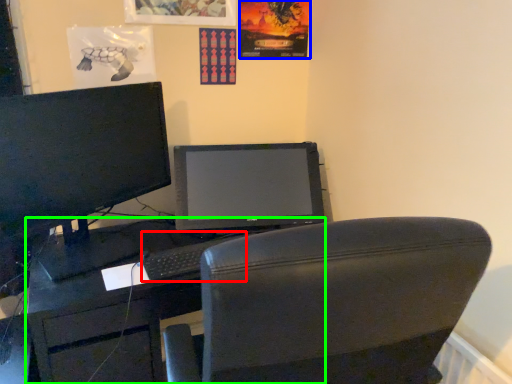
Question: Considering the real-world distances, which object is closest to keyboard (highlighted by a red box)? poster page (highlighted by a blue box) or desk (highlighted by a green box).

Choices:
 (A) poster page
 (B) desk

Answer: (B)